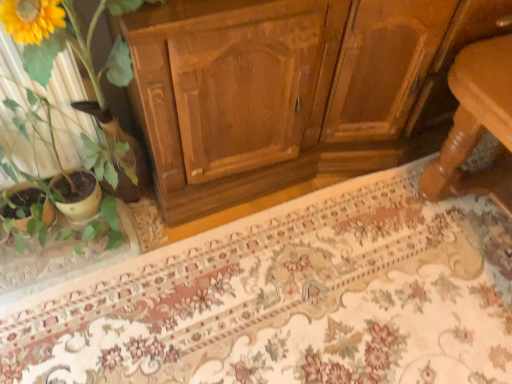
Question: From a real-world perspective, is matte yellow pot at left below floral carpet at center?

Choices:
 (A) no
 (B) yes

Answer: (A)

Question: Considering the relative sizes of matte yellow pot at left and floral carpet at center in the image provided, is matte yellow pot at left bigger than floral carpet at center?

Choices:
 (A) no
 (B) yes

Answer: (B)

Question: Would you consider matte yellow pot at left to be distant from floral carpet at center?

Choices:
 (A) no
 (B) yes

Answer: (A)

Question: Is matte yellow pot at left facing away from floral carpet at center?

Choices:
 (A) yes
 (B) no

Answer: (B)

Question: Considering the relative positions of matte yellow pot at left and floral carpet at center in the image provided, is matte yellow pot at left in front of floral carpet at center?

Choices:
 (A) yes
 (B) no

Answer: (A)

Question: Is matte yellow pot at left shorter than floral carpet at center?

Choices:
 (A) no
 (B) yes

Answer: (A)

Question: Is floral carpet at center smaller than matte yellow pot at left?

Choices:
 (A) yes
 (B) no

Answer: (A)

Question: Does floral carpet at center have a lesser width compared to matte yellow pot at left?

Choices:
 (A) yes
 (B) no

Answer: (B)

Question: Is floral carpet at center not within matte yellow pot at left?

Choices:
 (A) no
 (B) yes

Answer: (B)

Question: Considering the relative positions of floral carpet at center and matte yellow pot at left in the image provided, is floral carpet at center to the left of matte yellow pot at left from the viewer's perspective?

Choices:
 (A) yes
 (B) no

Answer: (B)

Question: From the image's perspective, is floral carpet at center located beneath matte yellow pot at left?

Choices:
 (A) yes
 (B) no

Answer: (A)

Question: Considering the relative sizes of floral carpet at center and matte yellow pot at left in the image provided, is floral carpet at center taller than matte yellow pot at left?

Choices:
 (A) no
 (B) yes

Answer: (A)

Question: From a real-world perspective, is floral carpet at center above or below matte yellow pot at left?

Choices:
 (A) above
 (B) below

Answer: (B)